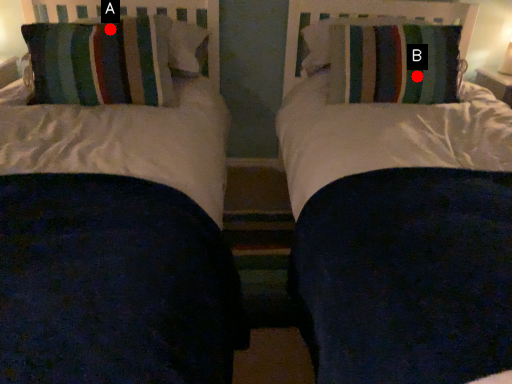
Question: Two points are circled on the image, labeled by A and B beside each circle. Among these points, which one is farthest from the camera?

Choices:
 (A) A is further
 (B) B is further

Answer: (B)